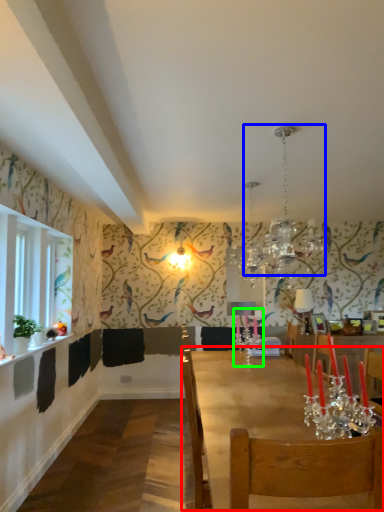
Question: Based on their relative distances, which object is farther from table (highlighted by a red box)? Choose from light fixture (highlighted by a blue box) and candle holder (highlighted by a green box).

Choices:
 (A) light fixture
 (B) candle holder

Answer: (A)